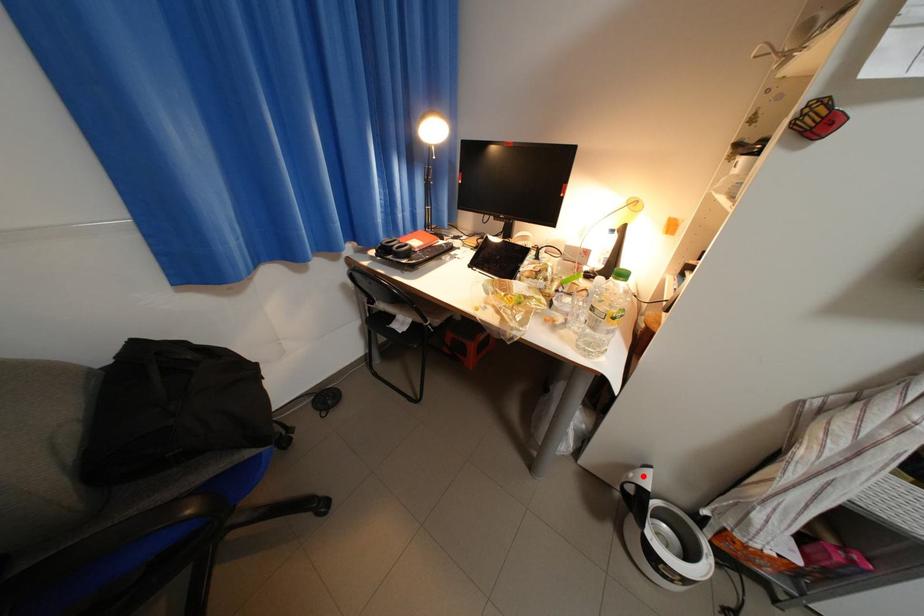
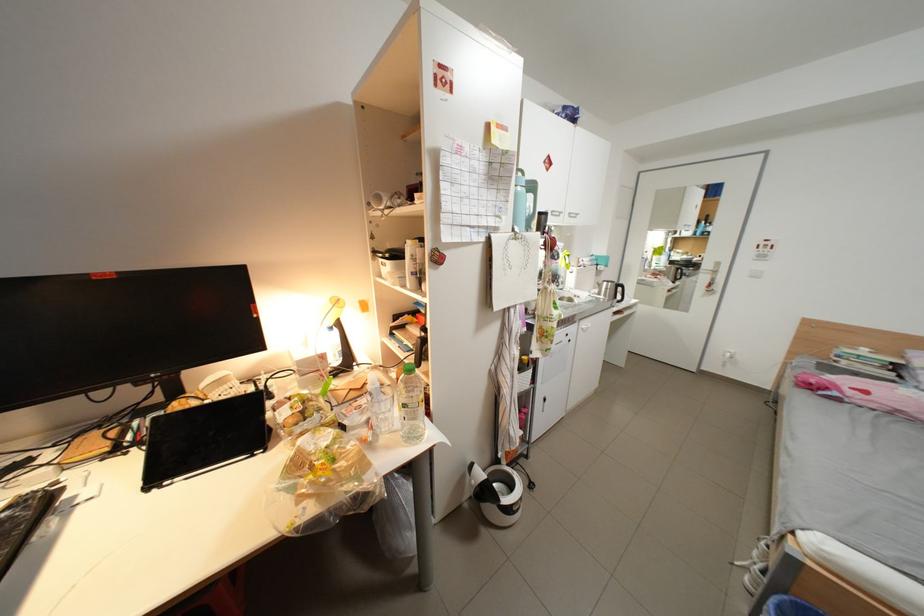
The point at the highlighted location is marked in the first image. Where is the corresponding point in the second image?

(484, 483)